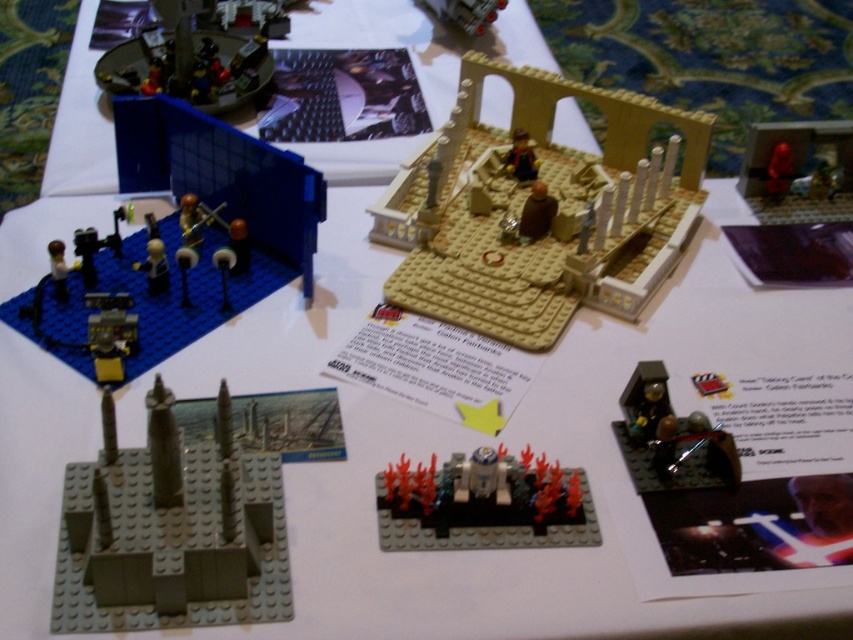
Question: Estimate the real-world distances between objects in this image. Which object is closer to the metallic silver spaceship at upper center?

Choices:
 (A) beige matte building at center
 (B) translucent red plastic r2-d2 at center

Answer: (A)

Question: Which of these objects is positioned farthest from the beige matte building at center?

Choices:
 (A) matte brown minifigure at center
 (B) dark gray plastic building at lower left

Answer: (B)

Question: Is beige matte building at center thinner than translucent red plastic r2-d2 at center?

Choices:
 (A) yes
 (B) no

Answer: (B)

Question: Can you confirm if metallic silver minifigure at lower right is positioned to the left of shiny red figure at upper right?

Choices:
 (A) yes
 (B) no

Answer: (A)

Question: Which is nearer to the metallic silver minifigure at lower right?

Choices:
 (A) shiny red figure at upper right
 (B) metallic silver spaceship at upper center

Answer: (A)

Question: Is dark gray plastic building at lower left behind metallic silver minifigure at lower right?

Choices:
 (A) no
 (B) yes

Answer: (A)